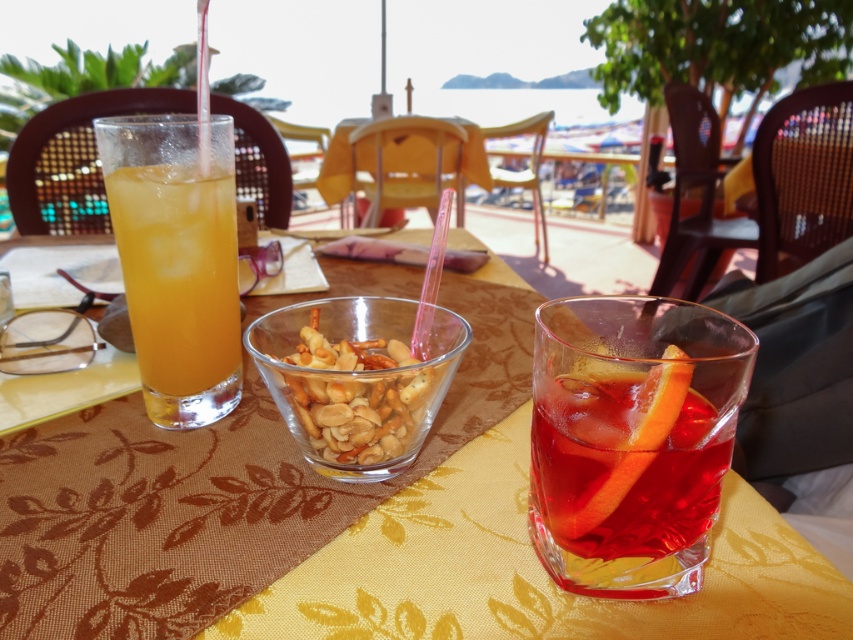
Question: Which is nearer to the translucent glass bowl of mixed nuts at center?

Choices:
 (A) translucent glass at left
 (B) translucent glass drink at center
 (C) yellow fabric placemat at center

Answer: (A)

Question: Does yellow fabric placemat at center have a larger size compared to translucent glass at left?

Choices:
 (A) yes
 (B) no

Answer: (A)

Question: Is translucent glass drink at center smaller than translucent glass bowl of mixed nuts at center?

Choices:
 (A) no
 (B) yes

Answer: (B)

Question: Which object is positioned farthest from the translucent glass at left?

Choices:
 (A) translucent glass bowl of mixed nuts at center
 (B) yellow fabric placemat at center

Answer: (B)

Question: Is yellow fabric placemat at center wider than translucent glass at left?

Choices:
 (A) no
 (B) yes

Answer: (B)

Question: Which point appears closest to the camera in this image?

Choices:
 (A) (524, 634)
 (B) (643, 518)

Answer: (A)